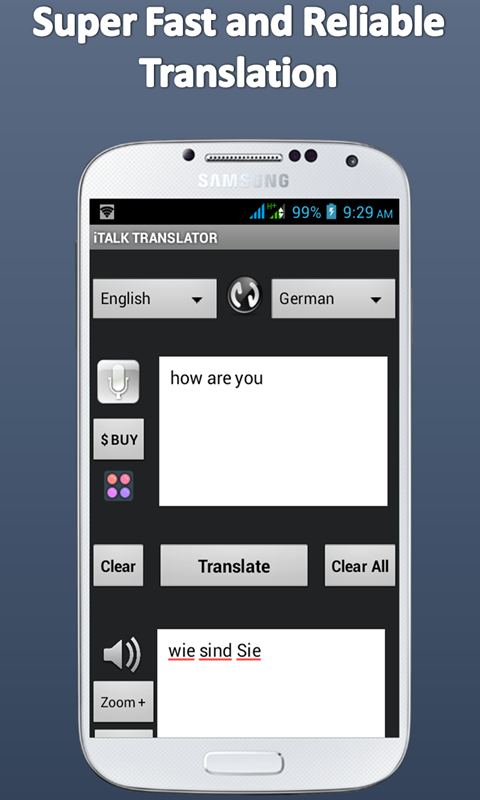
Where is `speaker`? Image resolution: width=480 pixels, height=800 pixels. speaker is located at coordinates (244, 158).